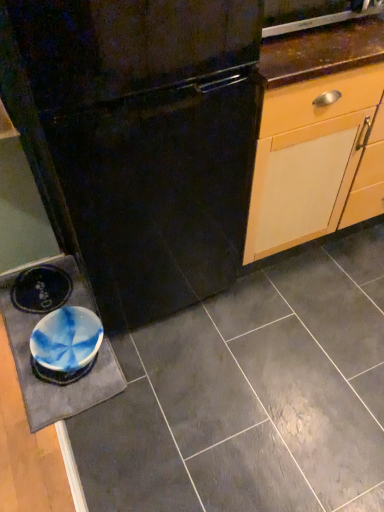
Find the location of a particular element. free point above matte ceramic tile at center (from a real-world perspective) is located at coordinates (215, 365).